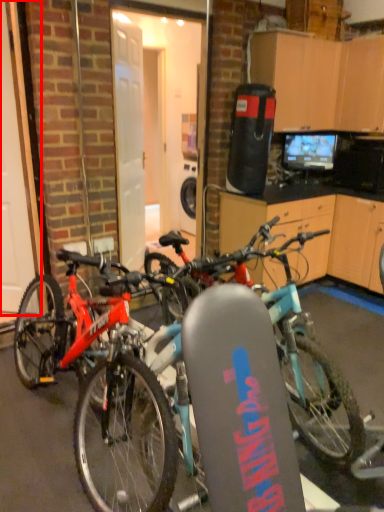
Question: Considering the relative positions of garage door (annotated by the red box) and bicycle in the image provided, where is garage door (annotated by the red box) located with respect to the staircase?

Choices:
 (A) left
 (B) right

Answer: (A)